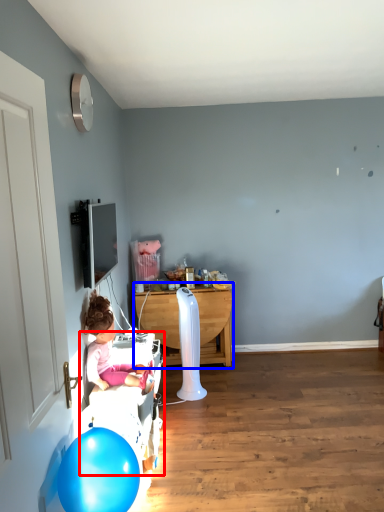
Question: Which of the following is the farthest to the observer, bed frame (highlighted by a red box) or table (highlighted by a blue box)?

Choices:
 (A) bed frame
 (B) table

Answer: (B)